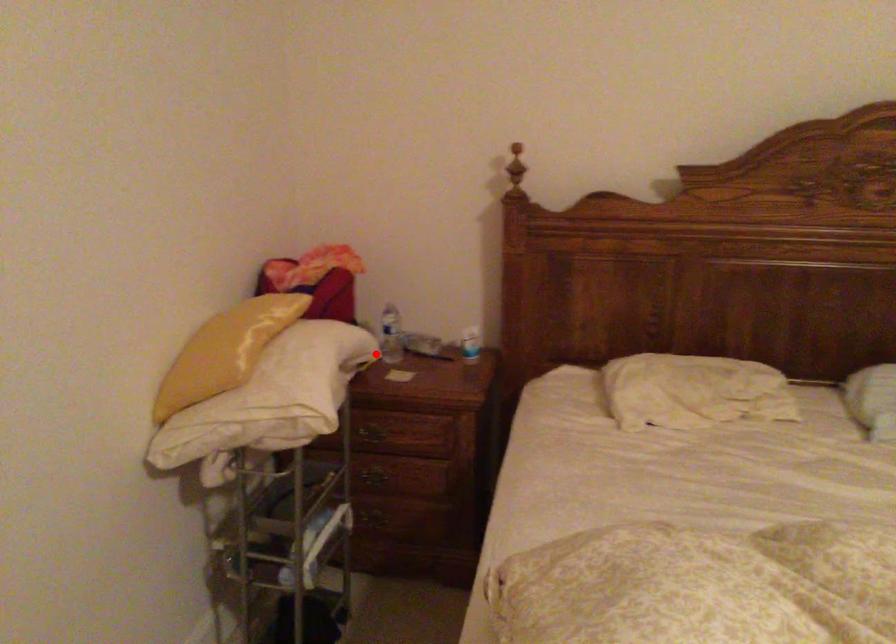
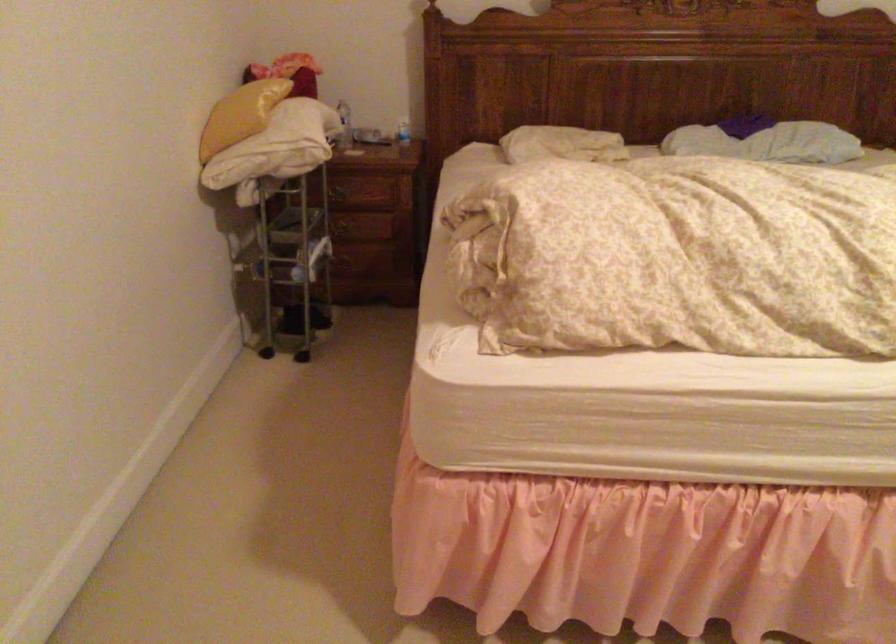
In the second image, find the point that corresponds to the highlighted location in the first image.

(343, 125)